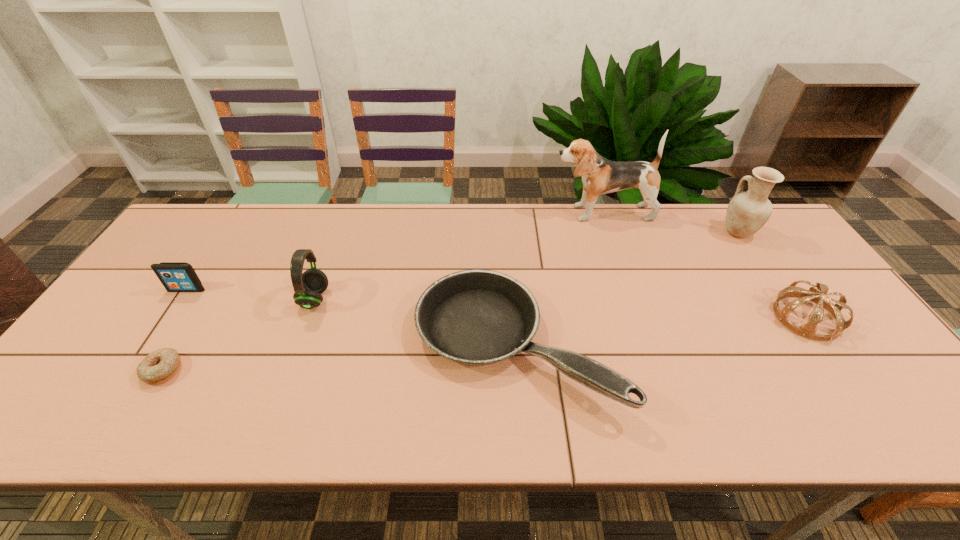
You are a GUI agent. You are given a task and a screenshot of the screen. Output one action in this format:
    pyautogui.click(x=<x>, y=<y>)
    Task: Click on the free space located 0.300m at the face of the puppy
    The image size is (960, 540).
    Given the screenshot: What is the action you would take?
    pyautogui.click(x=462, y=213)

Image resolution: width=960 pixels, height=540 pixels. Identify the location of vacant position located on the left of the pottery. (657, 232).

At what (x,y) coordinates should I click in order to perform the action: click on vacant point located 0.100m on the ear cups of the fifth object from right to left. Please return your answer as a coordinate pair (x, y). The image size is (960, 540). Looking at the image, I should click on (365, 299).

Find the location of a particular element. The width and height of the screenshot is (960, 540). free space located 0.370m on the left of the tiara is located at coordinates (632, 318).

Find the location of `vacant space located 0.140m on the front screen of the iPod`. vacant space located 0.140m on the front screen of the iPod is located at coordinates (158, 333).

Locate an element on the screen. This screenshot has height=540, width=960. blank space located on the left of the frying pan is located at coordinates click(333, 345).

Identify the location of vacant space situated on the back of the shortest object. This screenshot has width=960, height=540. (237, 249).

The height and width of the screenshot is (540, 960). In order to click on puppy at the far edge in this screenshot , I will do `click(600, 176)`.

The height and width of the screenshot is (540, 960). What are the coordinates of `pottery that is at the far edge` in the screenshot? It's located at (747, 212).

The image size is (960, 540). What are the coordinates of `object located at the near edge` in the screenshot? It's located at (476, 317).